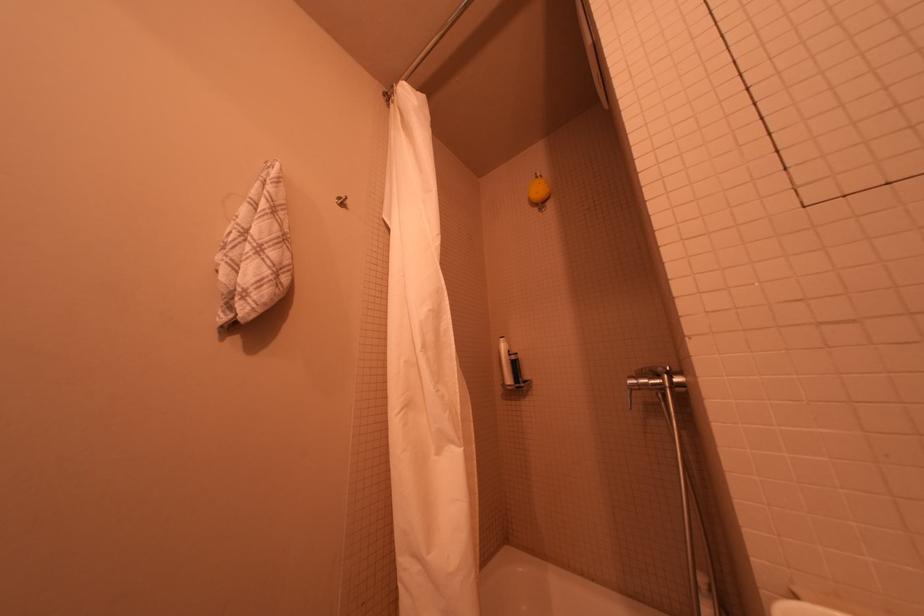
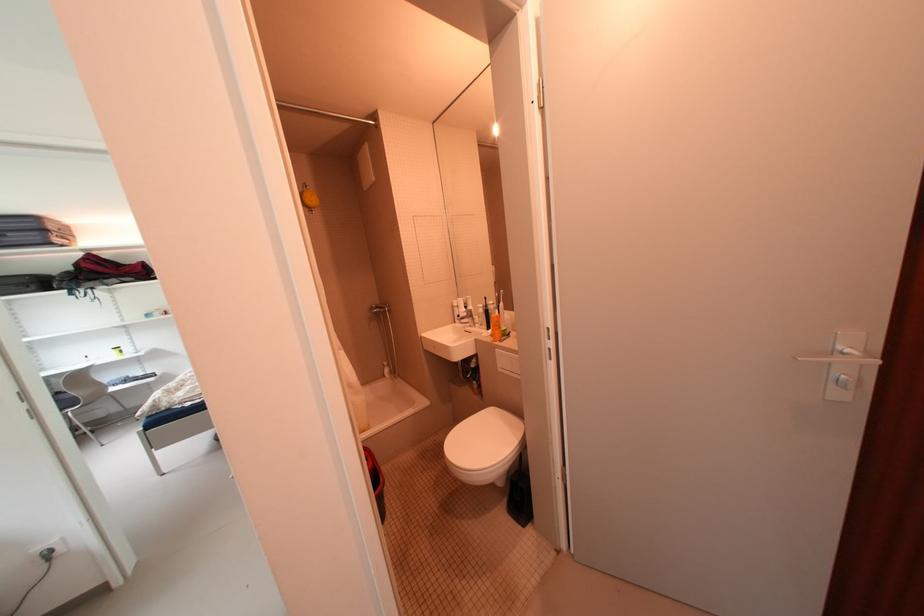
Where in the second image is the point corresponding to pixel 666 378 from the first image?

(390, 309)